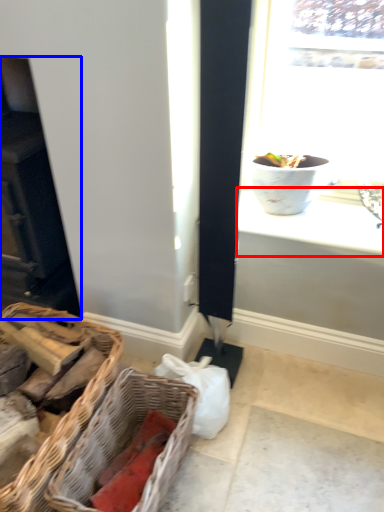
Question: Which object is further to the camera taking this photo, window sill (highlighted by a red box) or fireplace (highlighted by a blue box)?

Choices:
 (A) window sill
 (B) fireplace

Answer: (A)